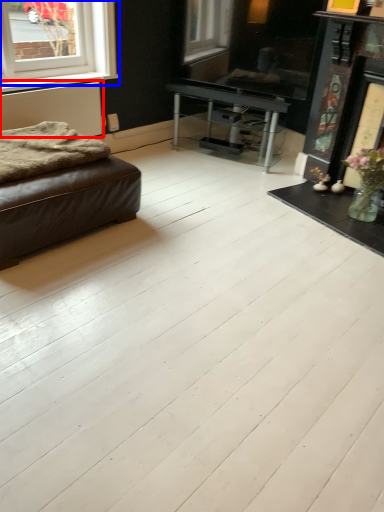
Question: Which of the following is the closest to the observer, radiator (highlighted by a red box) or window (highlighted by a blue box)?

Choices:
 (A) radiator
 (B) window

Answer: (B)